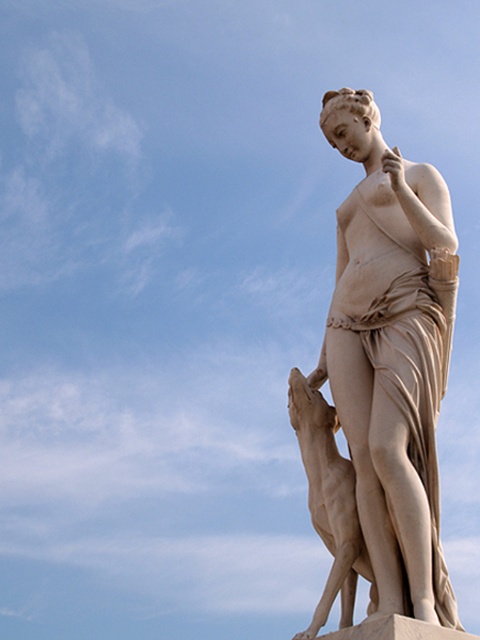
Does white marble statue at center have a greater height compared to matte stone dog at lower center?

Yes.

Who is shorter, white marble statue at center or matte stone dog at lower center?

With less height is matte stone dog at lower center.

The image size is (480, 640). What do you see at coordinates (384, 374) in the screenshot?
I see `white marble statue at center` at bounding box center [384, 374].

This screenshot has height=640, width=480. I want to click on white marble statue at center, so click(x=384, y=374).